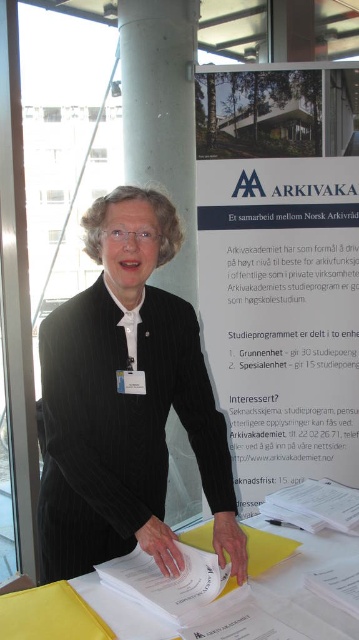
Does blue paper at upper center have a lesser height compared to white smooth pillar at center?

No, blue paper at upper center is not shorter than white smooth pillar at center.

Is blue paper at upper center taller than white smooth pillar at center?

Yes, blue paper at upper center is taller than white smooth pillar at center.

Is point (211, 365) closer to camera compared to point (190, 285)?

Yes.

Image resolution: width=359 pixels, height=640 pixels. I want to click on blue paper at upper center, so click(282, 316).

Looking at this image, who is taller, black woolen sweater at center or white smooth pillar at center?

white smooth pillar at center

Does black woolen sweater at center have a larger size compared to white smooth pillar at center?

Indeed, black woolen sweater at center has a larger size compared to white smooth pillar at center.

You are a GUI agent. You are given a task and a screenshot of the screen. Output one action in this format:
    pyautogui.click(x=<x>, y=<y>)
    Task: Click on the black woolen sweater at center
    This screenshot has height=640, width=359.
    Given the screenshot: What is the action you would take?
    pyautogui.click(x=126, y=401)

I want to click on black woolen sweater at center, so 126,401.

Does black woolen sweater at center have a greater height compared to blue paper at upper center?

No.

Does black woolen sweater at center appear on the right side of blue paper at upper center?

In fact, black woolen sweater at center is to the left of blue paper at upper center.

Between point (140, 243) and point (338, 260), which one is positioned behind?

Point (338, 260)

Locate an element on the screen. The width and height of the screenshot is (359, 640). black woolen sweater at center is located at coordinates (126, 401).